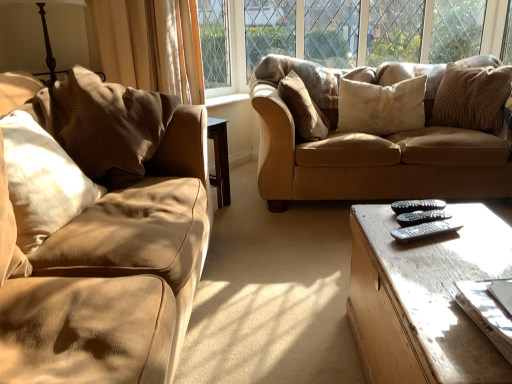
At what (x,y) coordinates should I click in order to perform the action: click on vacant area on top of light brown wooden coffee table at lower right (from a real-world perspective). Please return your answer as a coordinate pair (x, y). Looking at the image, I should click on (445, 250).